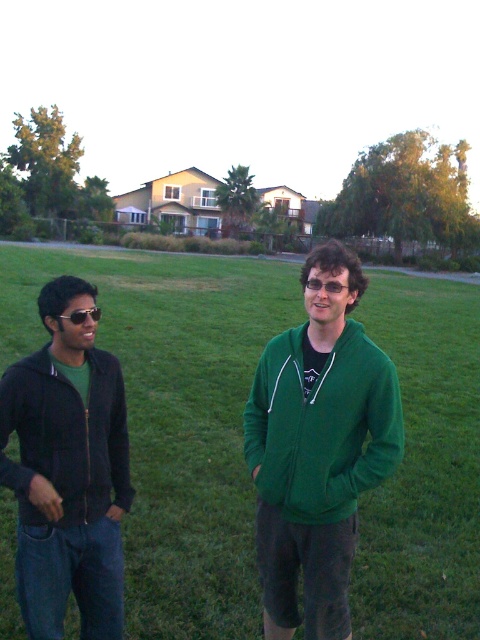
You are designing a new clothing line and want to ensure that the green matte hoodie at center and the matte black jacket at left can be worn together in a photo shoot. Based on their sizes, which one would you place in the foreground to make the models look proportionally balanced?

The green matte hoodie at center is bigger than the matte black jacket at left. To achieve proportional balance, place the larger green matte hoodie at center in the foreground so its size contrasts effectively with the smaller matte black jacket at left in the background.

From the picture: You are standing 10 feet away from the green matte hoodie at center. Can you reach it without moving closer?

The green matte hoodie at center is 11.05 feet away from the viewer, so you cannot reach it without moving closer since you are currently 10 feet away.

You are trying to determine which object is bigger between the green fleece jacket at center and the sunglasses at center. Based on the scene, which one is larger?

The green fleece jacket at center is larger than the sunglasses at center.